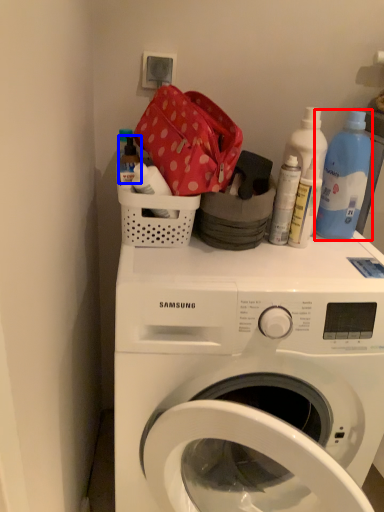
Question: Among these objects, which one is nearest to the camera, cleaning product (highlighted by a red box) or bottle (highlighted by a blue box)?

Choices:
 (A) cleaning product
 (B) bottle

Answer: (A)